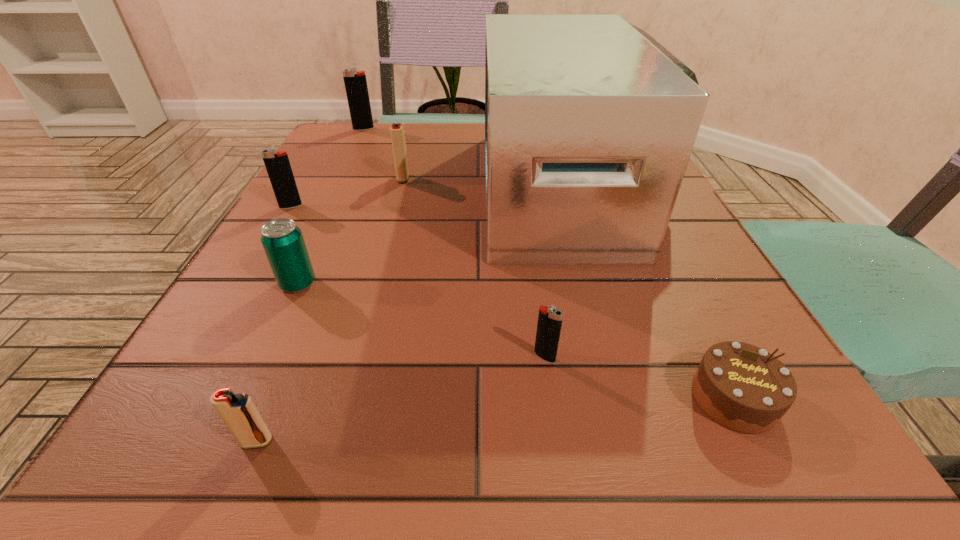
In the image, there is a desktop. Where is `free region at the right edge`? The image size is (960, 540). free region at the right edge is located at coordinates (675, 228).

The width and height of the screenshot is (960, 540). Find the location of `vacant space at the far left corner of the desktop`. vacant space at the far left corner of the desktop is located at coordinates (378, 123).

At what (x,y) coordinates should I click in order to perform the action: click on free space at the near right corner of the desktop. Please return your answer as a coordinate pair (x, y). Looking at the image, I should click on (722, 454).

Locate an element on the screen. This screenshot has height=540, width=960. free space between the shortest object and the teal beer can is located at coordinates (516, 341).

At what (x,y) coordinates should I click in order to perform the action: click on vacant space that's between the farther red igniter and the third igniter from left to right. Please return your answer as a coordinate pair (x, y). The width and height of the screenshot is (960, 540). Looking at the image, I should click on (330, 310).

Find the location of a particular element. This screenshot has height=540, width=960. free area in between the brown chocolate cake and the second farthest igniter is located at coordinates (568, 288).

Identify the location of free space between the beer can and the bigger red igniter. The width and height of the screenshot is (960, 540). (350, 231).

At what (x,y) coordinates should I click in order to perform the action: click on blank region between the farther red igniter and the tallest igniter. Please return your answer as a coordinate pair (x, y). Image resolution: width=960 pixels, height=540 pixels. Looking at the image, I should click on (383, 153).

Identify the location of empty space between the smallest black igniter and the fourth nearest object. This screenshot has height=540, width=960. (421, 320).

The image size is (960, 540). In order to click on vacant area that lies between the chocolate cake and the microwave oven in this screenshot , I will do `click(653, 294)`.